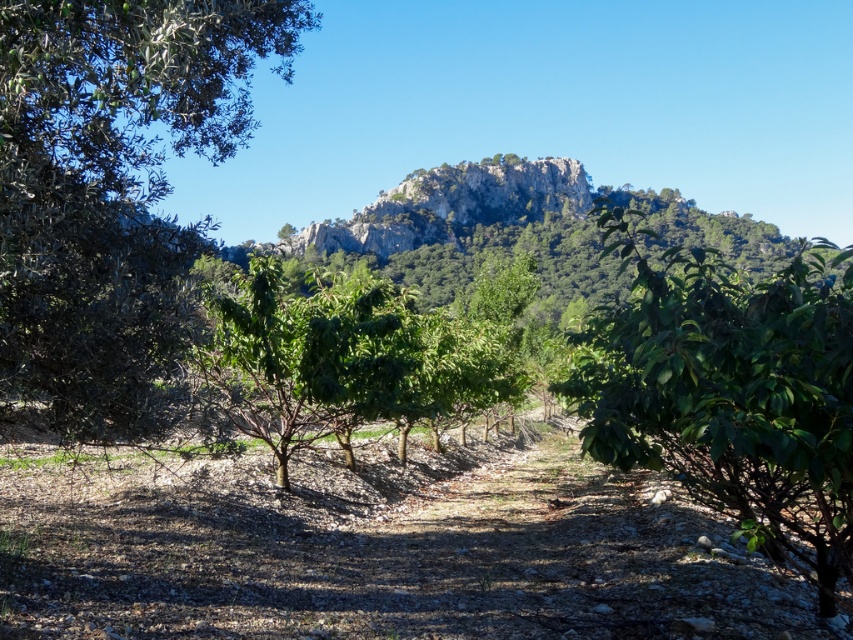
How far apart are green glossy tree at center and green leafy tree at center?

green glossy tree at center is 7.75 meters from green leafy tree at center.

Which is in front, point (772, 552) or point (207, 348)?

Point (772, 552)

Where is `green glossy tree at center`? The height and width of the screenshot is (640, 853). green glossy tree at center is located at coordinates (730, 392).

Looking at this image, between green leafy tree at left and green glossy tree at center, which one has less height?

green leafy tree at left is shorter.

Where is `green leafy tree at left`? This screenshot has width=853, height=640. green leafy tree at left is located at coordinates (112, 188).

Is green leafy tree at center thinner than rocky gray mountain at center?

Correct, green leafy tree at center's width is less than rocky gray mountain at center's.

Is point (252, 371) farther from camera compared to point (440, 300)?

No, (252, 371) is in front of (440, 300).

Where is `green leafy tree at center`? This screenshot has height=640, width=853. green leafy tree at center is located at coordinates (357, 355).